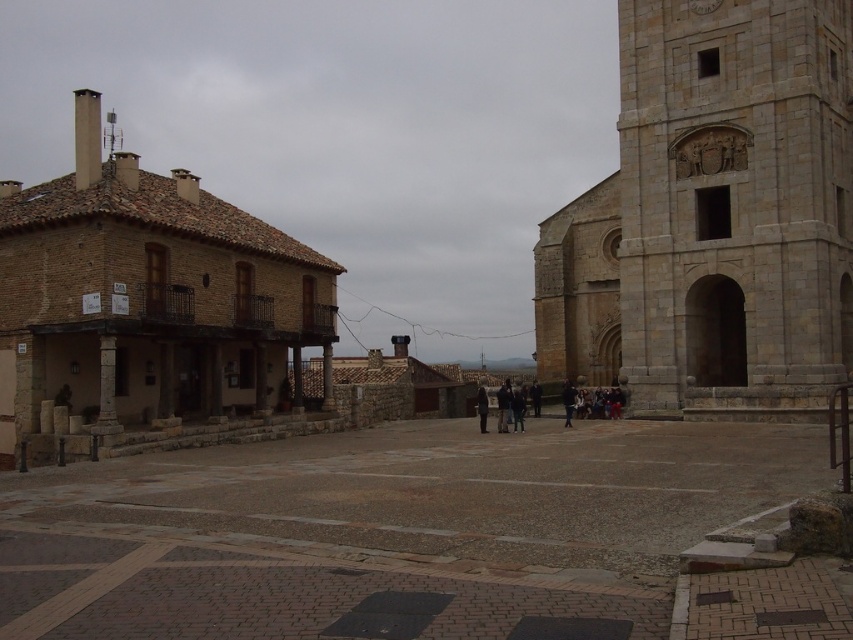
You are standing in the square and want to reach the point marked at coordinates (776, 102). If you can walk 100 feet per minute, how long will it take you to reach that point?

The distance between you and the point marked at coordinates (776, 102) is 228.58 feet. At a walking speed of 100 feet per minute, it will take approximately 2.29 minutes to reach the point.

You are an architect analyzing the square. Based on the scene, which object is taller between the brown brick church at left and the gold textured clock at upper right?

The brown brick church at left is taller than the gold textured clock at upper right according to the description.